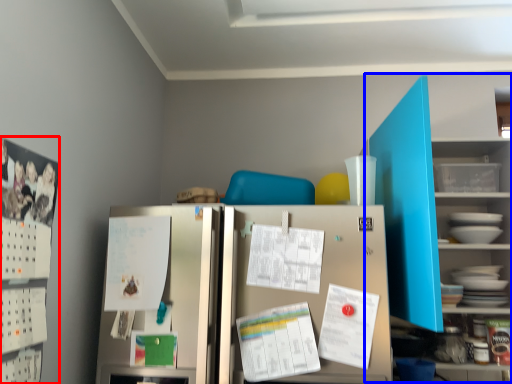
Question: Which of the following is the farthest to the observer, bulletin board (highlighted by a red box) or bookshelf (highlighted by a blue box)?

Choices:
 (A) bulletin board
 (B) bookshelf

Answer: (B)